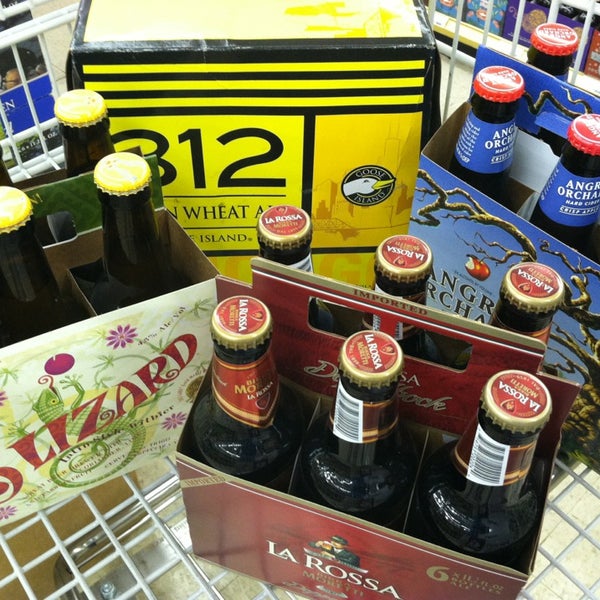
At what (x,y) coordinates should I click in order to perform the action: click on white rack. Please return your answer as a coordinate pair (x, y). Image resolution: width=600 pixels, height=600 pixels. Looking at the image, I should click on (555, 565).